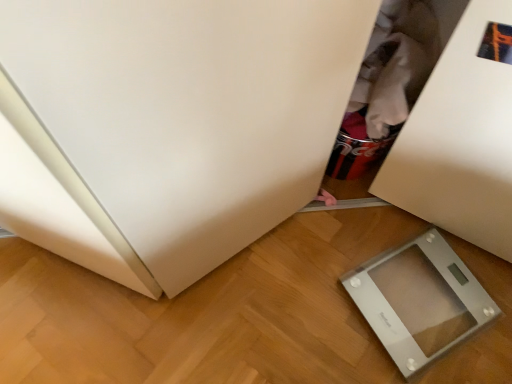
Describe the element at coordinates (419, 300) in the screenshot. Image resolution: width=512 pixels, height=384 pixels. I see `transparent glass scale at lower right` at that location.

This screenshot has height=384, width=512. I want to click on transparent glass scale at lower right, so click(x=419, y=300).

Where is `transparent glass scale at lower right`? The width and height of the screenshot is (512, 384). transparent glass scale at lower right is located at coordinates (419, 300).